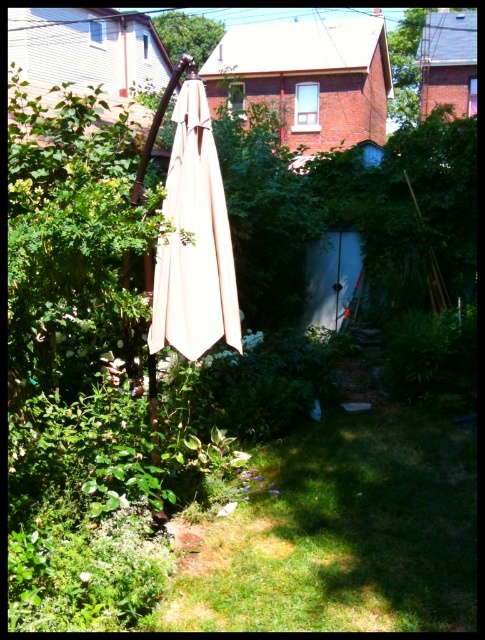
You are standing in the backyard and want to take a photo of the green leafy tree at upper center. However, the beige fabric umbrella at center is blocking your view. Can you move the umbrella to the side to get a clear shot?

The beige fabric umbrella at center is in front of the green leafy tree at upper center, so moving it aside would allow you to see the tree clearly.

You are standing in the backyard and want to place a new garden statue between the beige fabric umbrella at center and the green leafy tree at upper center. Based on their positions, which object should the statue be closer to?

The beige fabric umbrella at center is to the right of the green leafy tree at upper center, so the statue should be placed closer to the green leafy tree at upper center to maintain symmetry between them.